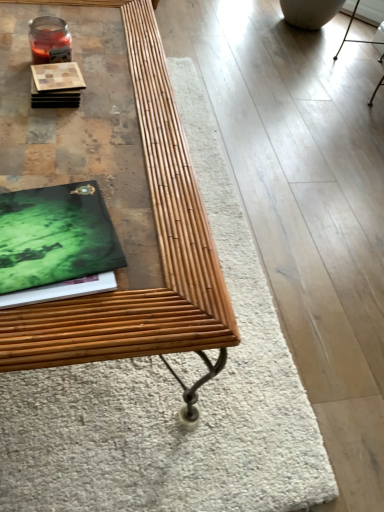
The image size is (384, 512). I want to click on blank space situated above green matte book at left (from a real-world perspective), so click(49, 233).